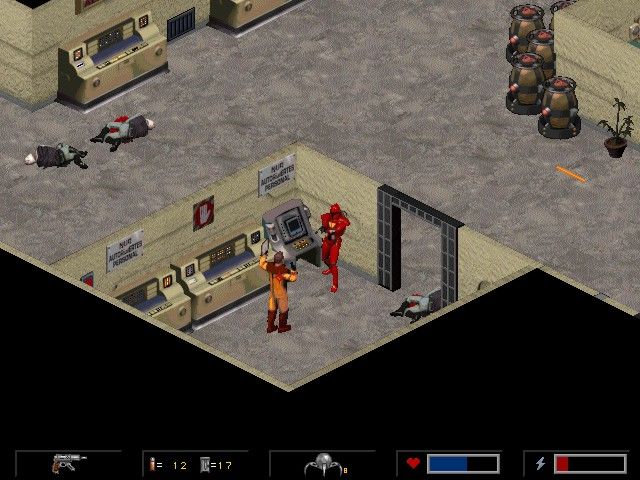
I want to click on gray floor, so (x=331, y=86), (x=310, y=341).